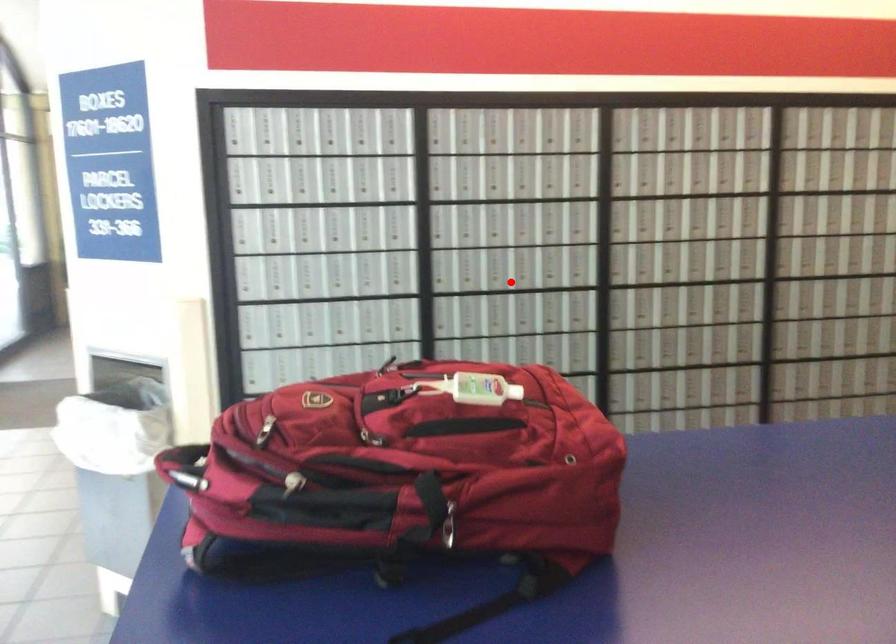
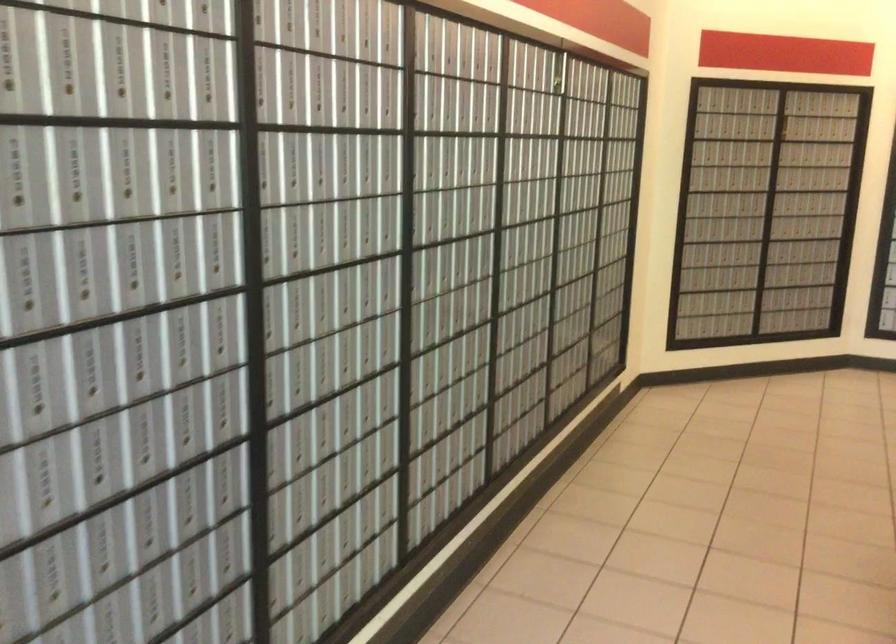
Question: I am providing you with two images of the same scene from different viewpoints. A red point is shown in image1. For the corresponding object point in image2, is it positioned nearer or farther from the camera?

Choices:
 (A) Nearer
 (B) Farther

Answer: (A)